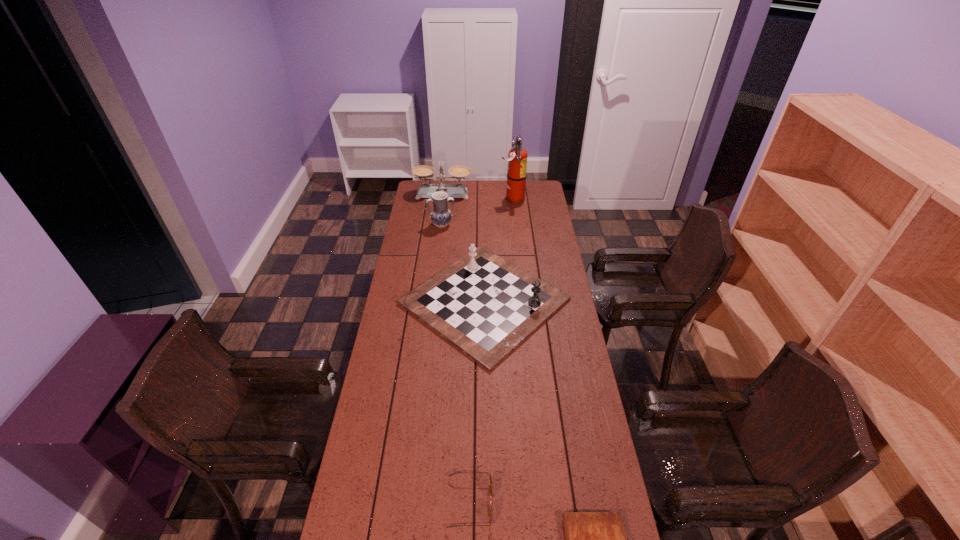
Locate an element on the screen. This screenshot has height=540, width=960. free spot located on the back of the pottery is located at coordinates (443, 215).

Where is `blank space located on the front of the fourth farthest object`? The image size is (960, 540). blank space located on the front of the fourth farthest object is located at coordinates (485, 383).

Where is `vacant region located on the lenses of the second shortest object`? vacant region located on the lenses of the second shortest object is located at coordinates click(x=610, y=503).

Identify the location of fire extinguisher positioned at the far edge. (517, 157).

Find the location of a particular element. scale that is at the far edge is located at coordinates (424, 172).

I want to click on scale that is at the left edge, so click(424, 172).

Where is `pottery at the left edge`? This screenshot has width=960, height=540. pottery at the left edge is located at coordinates (441, 216).

I want to click on gameboard located at the left edge, so click(x=485, y=306).

This screenshot has height=540, width=960. Find the location of `fire extinguisher located in the right edge section of the desktop`. fire extinguisher located in the right edge section of the desktop is located at coordinates (517, 157).

You are a GUI agent. You are given a task and a screenshot of the screen. Output one action in this format:
    pyautogui.click(x=<x>, y=<y>)
    Task: Click on the gameboard that is at the right edge
    This screenshot has width=960, height=540.
    Given the screenshot: What is the action you would take?
    pyautogui.click(x=485, y=306)